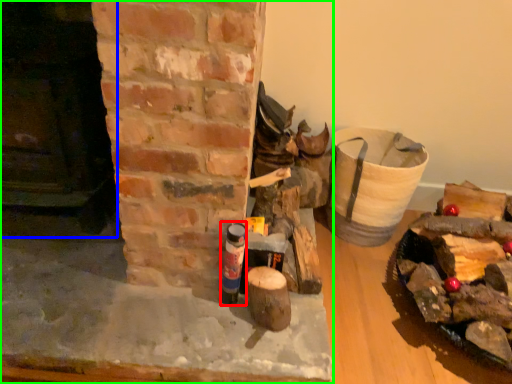
Question: Which object is the farthest from bottle (highlighted by a red box)? Choose among these: fireplace (highlighted by a blue box) or fireplace (highlighted by a green box).

Choices:
 (A) fireplace
 (B) fireplace

Answer: (A)